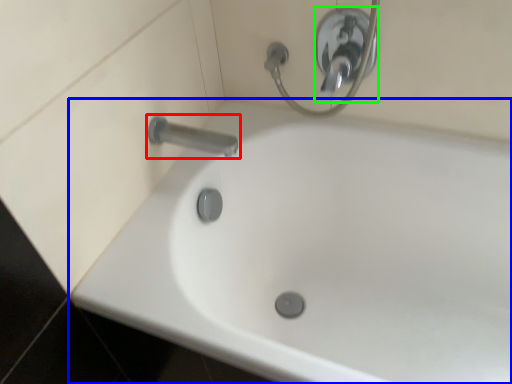
Question: Considering the real-world distances, which object is closest to tap (highlighted by a red box)? bathtub (highlighted by a blue box) or shower (highlighted by a green box).

Choices:
 (A) bathtub
 (B) shower

Answer: (B)